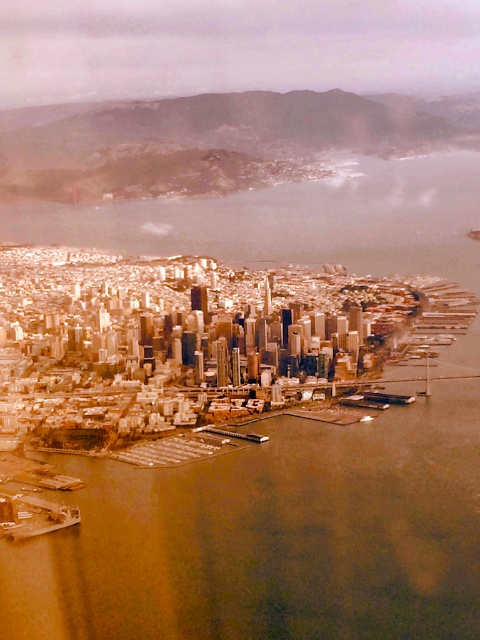
Question: Among these points, which one is nearest to the camera?

Choices:
 (A) pos(319,529)
 (B) pos(38,518)
 (C) pos(428,356)

Answer: (C)

Question: Which object is the farthest from the brown water at center?

Choices:
 (A) metallic gray boat at lower left
 (B) white plastic boat at lower right

Answer: (B)

Question: Which of these objects is positioned farthest from the white plastic boat at lower right?

Choices:
 (A) brown water at center
 (B) metallic gray boat at lower left

Answer: (B)

Question: Is brown water at center positioned behind metallic gray boat at lower left?

Choices:
 (A) no
 (B) yes

Answer: (A)

Question: Is metallic gray boat at lower left bigger than white plastic boat at lower right?

Choices:
 (A) yes
 (B) no

Answer: (A)

Question: Is brown water at center positioned before white plastic boat at lower right?

Choices:
 (A) no
 (B) yes

Answer: (B)